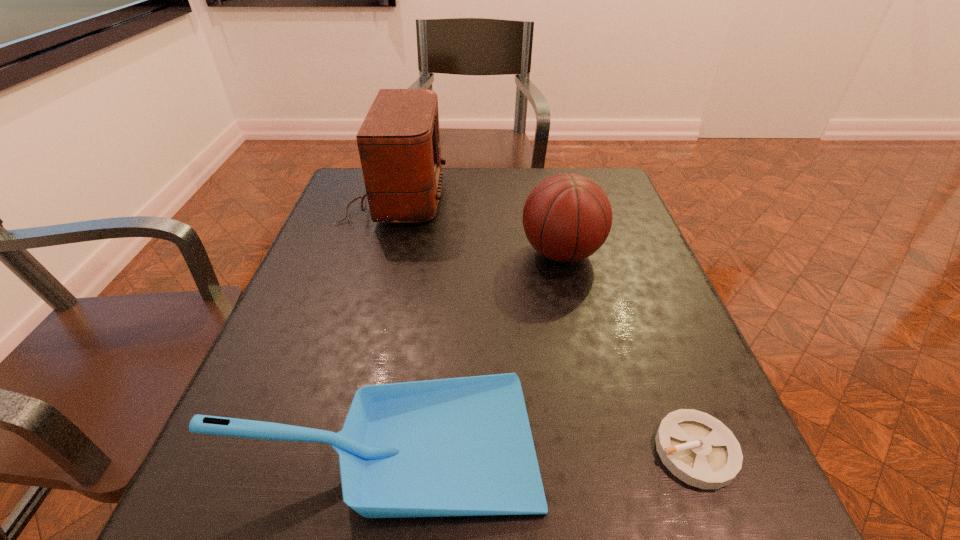
Where is `the farthest object`? the farthest object is located at coordinates (399, 146).

At what (x,y) coordinates should I click in order to perform the action: click on the tallest object. Please return your answer as a coordinate pair (x, y). This screenshot has height=540, width=960. Looking at the image, I should click on (399, 146).

The image size is (960, 540). What are the coordinates of `the third shortest object` in the screenshot? It's located at (567, 217).

At what (x,y) coordinates should I click in order to perform the action: click on the second farthest object. Please return your answer as a coordinate pair (x, y). Looking at the image, I should click on pyautogui.click(x=567, y=217).

Identify the location of the third tallest object. (463, 446).

You are a GUI agent. You are given a task and a screenshot of the screen. Output one action in this format:
    pyautogui.click(x=<x>, y=<y>)
    Task: Click on the shortest object
    This screenshot has width=960, height=540.
    Given the screenshot: What is the action you would take?
    pyautogui.click(x=697, y=448)

You are a GUI agent. You are given a task and a screenshot of the screen. Output one action in this format:
    pyautogui.click(x=<x>, y=<y>)
    Task: Click on the vacant area situated 0.080m on the front panel of the farthest object
    This screenshot has width=960, height=540.
    Given the screenshot: What is the action you would take?
    pyautogui.click(x=474, y=197)

The height and width of the screenshot is (540, 960). What are the coordinates of `free space located 0.060m on the left of the third nearest object` in the screenshot? It's located at (494, 253).

At what (x,y) coordinates should I click in order to perform the action: click on free space located 0.220m on the back of the dustpan. Please return your answer as a coordinate pair (x, y). The width and height of the screenshot is (960, 540). Looking at the image, I should click on (414, 292).

Find the location of a particular element. Image resolution: width=960 pixels, height=540 pixels. vacant space situated 0.250m on the left of the shortest object is located at coordinates (491, 451).